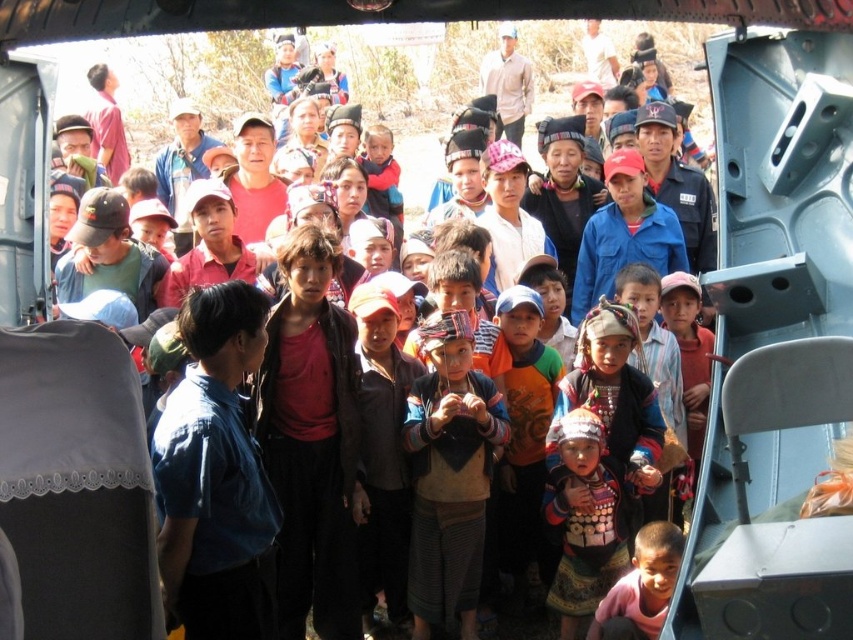
Who is higher up, multicolored fabric at center or pink fabric shirt at lower right?

Positioned higher is multicolored fabric at center.

Is multicolored fabric at center shorter than pink fabric shirt at lower right?

No.

Between point (473, 477) and point (619, 609), which one is positioned behind?

The point (473, 477) is behind.

Image resolution: width=853 pixels, height=640 pixels. I want to click on multicolored fabric at center, so click(450, 476).